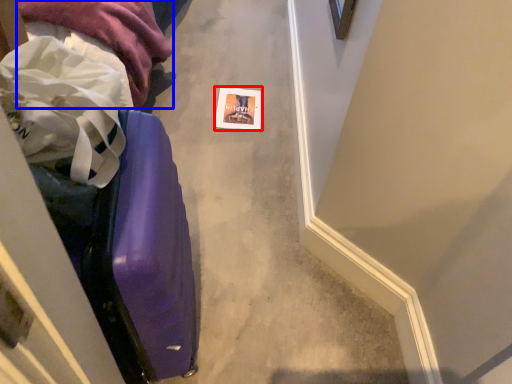
Question: Which of the following is the closest to the observer, postcard (highlighted by a red box) or clothing (highlighted by a blue box)?

Choices:
 (A) postcard
 (B) clothing

Answer: (B)